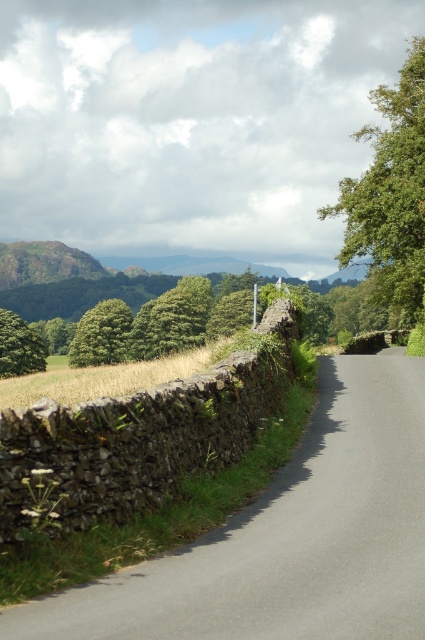
Question: Based on their relative distances, which object is nearer to the green leafy tree at upper right?

Choices:
 (A) smooth asphalt road at center
 (B) green leafy tree at upper left
 (C) green leafy tree at left

Answer: (A)

Question: Estimate the real-world distances between objects in this image. Which object is closer to the green leafy tree at upper right?

Choices:
 (A) green leafy tree at upper left
 (B) smooth asphalt road at center
 (C) green leafy tree at left

Answer: (B)

Question: Which of the following is the farthest from the observer?

Choices:
 (A) green leafy tree at upper left
 (B) green leafy tree at left
 (C) green leafy tree at upper right

Answer: (A)

Question: Does green leafy tree at upper left have a smaller size compared to green leafy tree at left?

Choices:
 (A) yes
 (B) no

Answer: (B)

Question: Is the position of smooth asphalt road at center more distant than that of green leafy tree at upper left?

Choices:
 (A) yes
 (B) no

Answer: (B)

Question: Is smooth asphalt road at center closer to the viewer compared to green leafy tree at upper left?

Choices:
 (A) yes
 (B) no

Answer: (A)